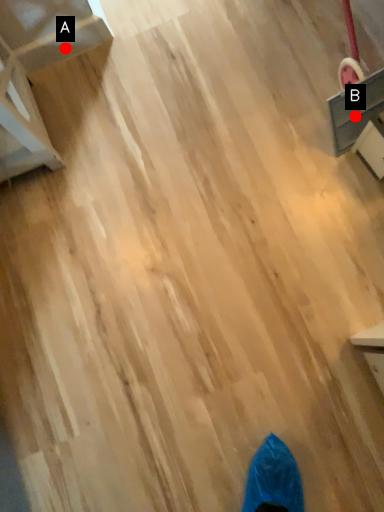
Question: Two points are circled on the image, labeled by A and B beside each circle. Which of the following is the farthest from the observer?

Choices:
 (A) A is further
 (B) B is further

Answer: (A)